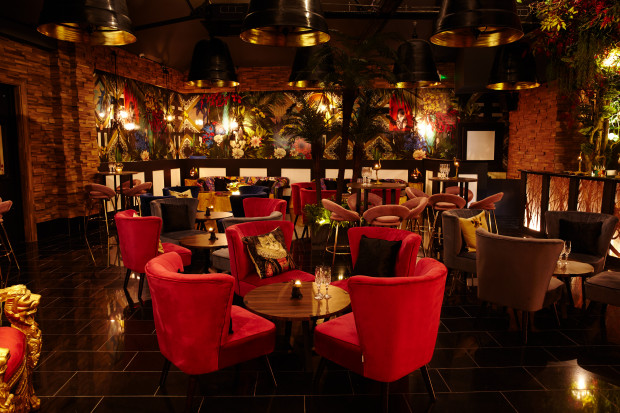
I want to click on screen panels with branches design, so click(560, 193), click(533, 184), click(591, 195), click(617, 201).